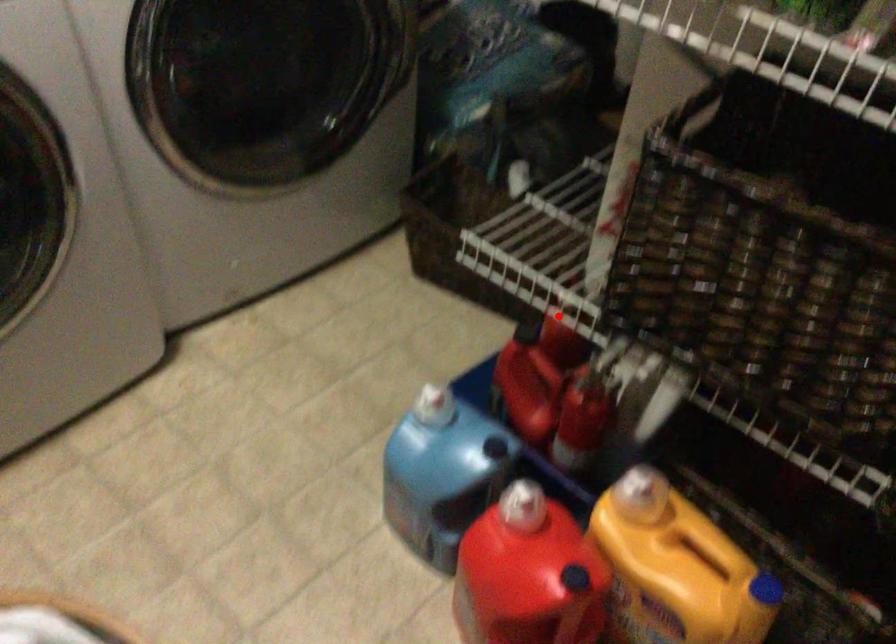
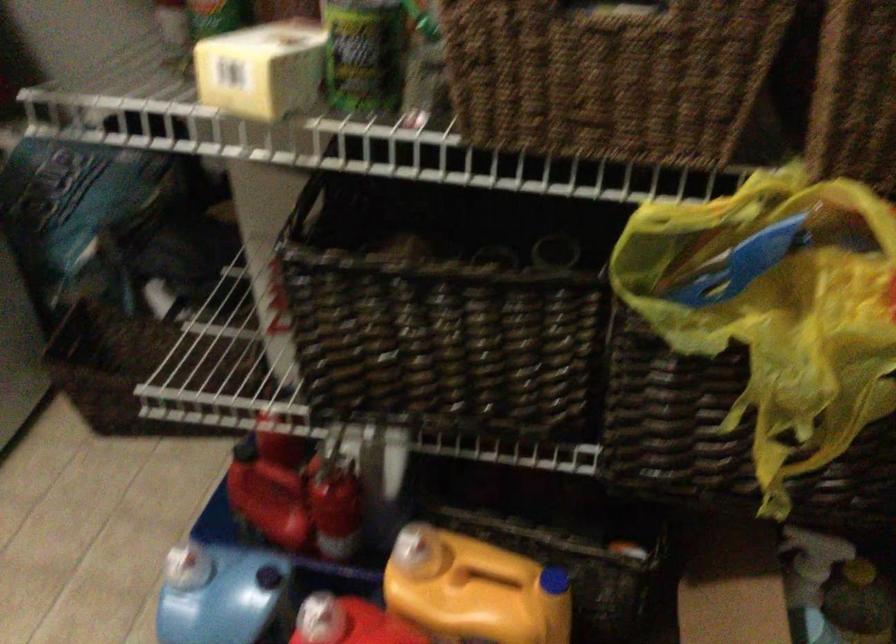
In the second image, find the point that corresponds to the highlighted location in the first image.

(269, 426)